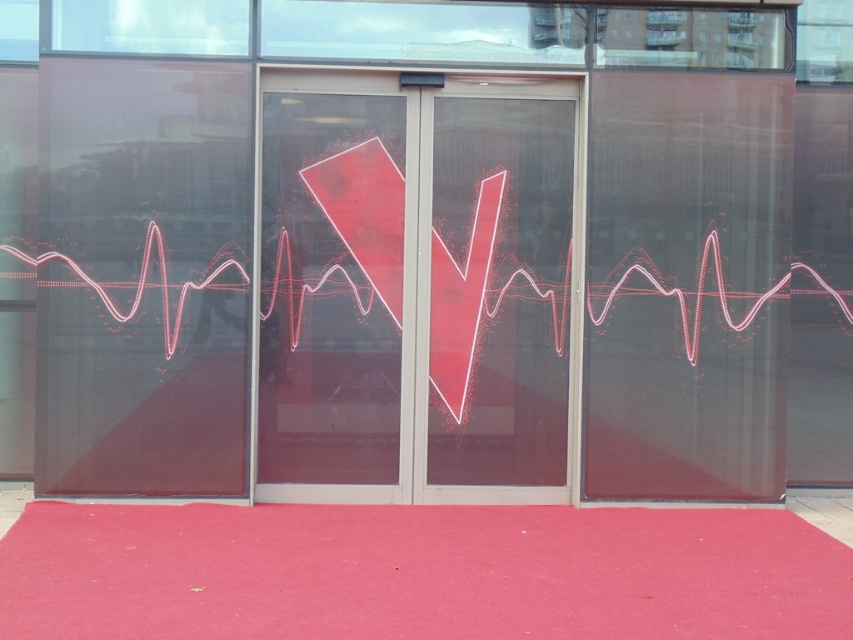
You are standing in front of the transparent glass door at center and the matte red carpet at center. Which object is closer to you?

The transparent glass door at center is closer to you than the matte red carpet at center.

You are standing in front of the transparent glass door at center. To avoid walking into the glass, which direction should you move based on the reflection shown in the image?

The transparent glass door at center is located at point (419, 288), so you should move away from that coordinate to avoid walking into the glass.

You are a delivery person trying to enter the building through the transparent glass door at center. The door is narrower than the matte red carpet at center. Can you fit through the door if your delivery cart is 1.2 meters wide?

The transparent glass door at center has a lesser width compared to the matte red carpet at center. If the door is narrower than the carpet, but the exact width isn not provided, we cannot determine if the 1.2 meter wide cart can pass. More information is needed.